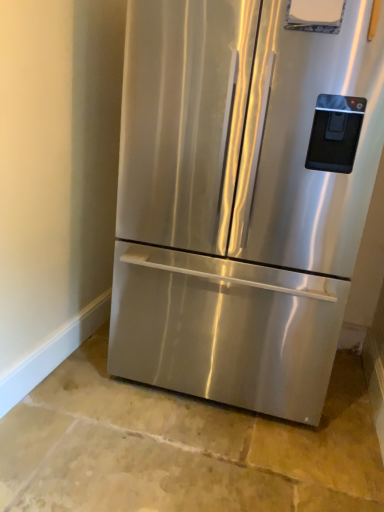
Identify the location of vacant area in front of stainless steel refrigerator at center. The image size is (384, 512). (203, 457).